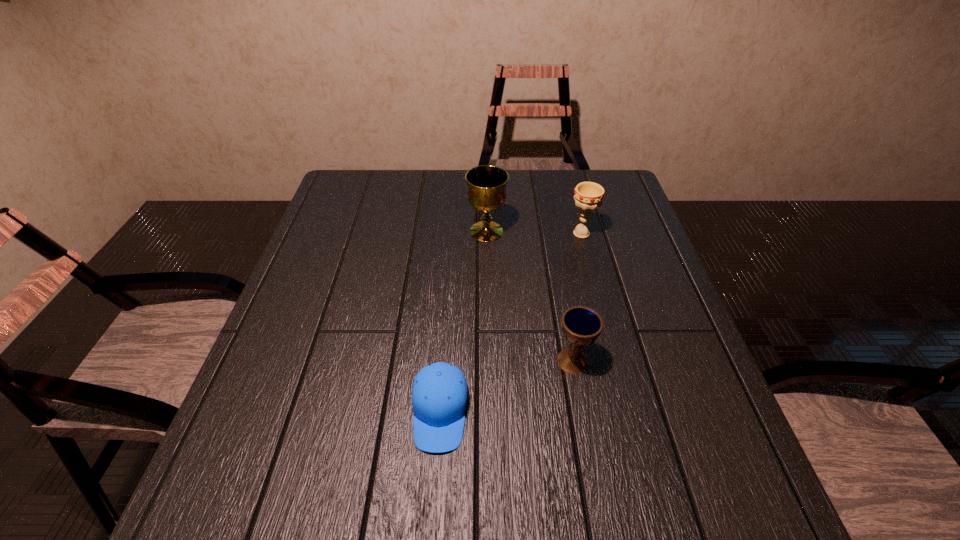
You are a GUI agent. You are given a task and a screenshot of the screen. Output one action in this format:
    pyautogui.click(x=<x>, y=<y>)
    Task: Click on the free space between the leftmost chalice and the second chalice from left to right
    
    Given the screenshot: What is the action you would take?
    pyautogui.click(x=530, y=296)

Locate an element on the screen. The height and width of the screenshot is (540, 960). blank region between the shortest object and the second chalice from left to right is located at coordinates (507, 386).

Image resolution: width=960 pixels, height=540 pixels. Find the location of `unoccupied position between the rightmost object and the tallest chalice`. unoccupied position between the rightmost object and the tallest chalice is located at coordinates (534, 232).

This screenshot has width=960, height=540. Identify the location of vacant area that lies between the rightmost chalice and the shortest object. pyautogui.click(x=511, y=323).

Locate an element on the screen. This screenshot has height=540, width=960. free area in between the rightmost chalice and the second chalice from right to left is located at coordinates (577, 297).

Identify which object is located as the second nearest to the cap. Please provide its 2D coordinates. Your answer should be formatted as a tuple, i.e. [(x, y)], where the tuple contains the x and y coordinates of a point satisfying the conditions above.

[(487, 184)]

Select which object appears as the closest to the rightmost object. Please provide its 2D coordinates. Your answer should be formatted as a tuple, i.e. [(x, y)], where the tuple contains the x and y coordinates of a point satisfying the conditions above.

[(487, 184)]

The width and height of the screenshot is (960, 540). Identify the location of chalice that is the second closest to the rightmost object. [x=581, y=326].

Select which chalice appears as the second closest to the shortest object. Please provide its 2D coordinates. Your answer should be formatted as a tuple, i.e. [(x, y)], where the tuple contains the x and y coordinates of a point satisfying the conditions above.

[(487, 184)]

I want to click on vacant space that satisfies the following two spatial constraints: 1. on the front side of the leftmost chalice; 2. on the right side of the rightmost object, so click(x=487, y=233).